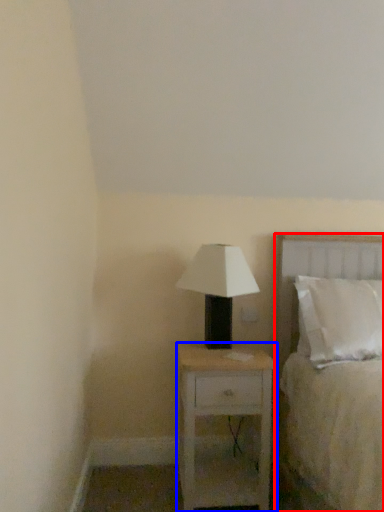
Question: Which object appears farthest to the camera in this image, bed (highlighted by a red box) or nightstand (highlighted by a blue box)?

Choices:
 (A) bed
 (B) nightstand

Answer: (B)